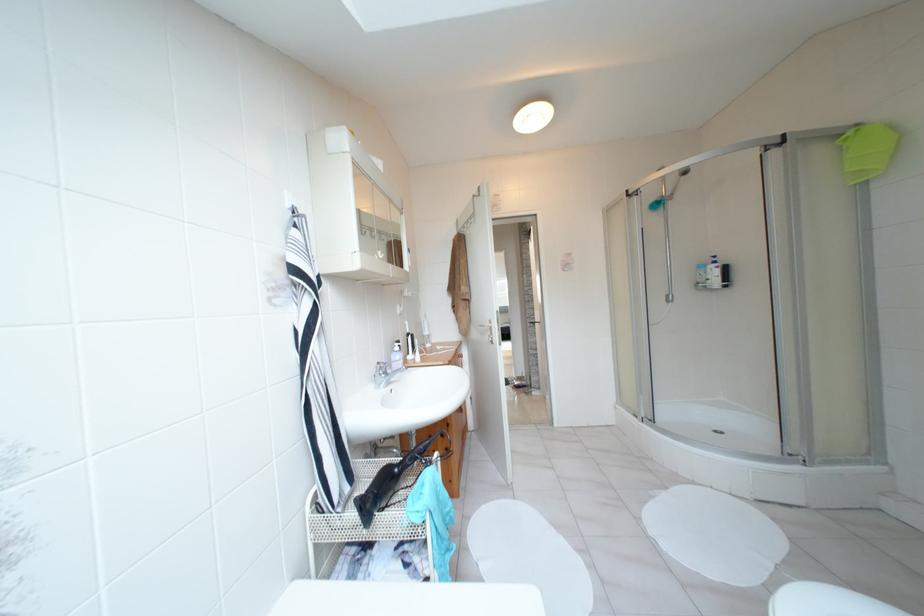
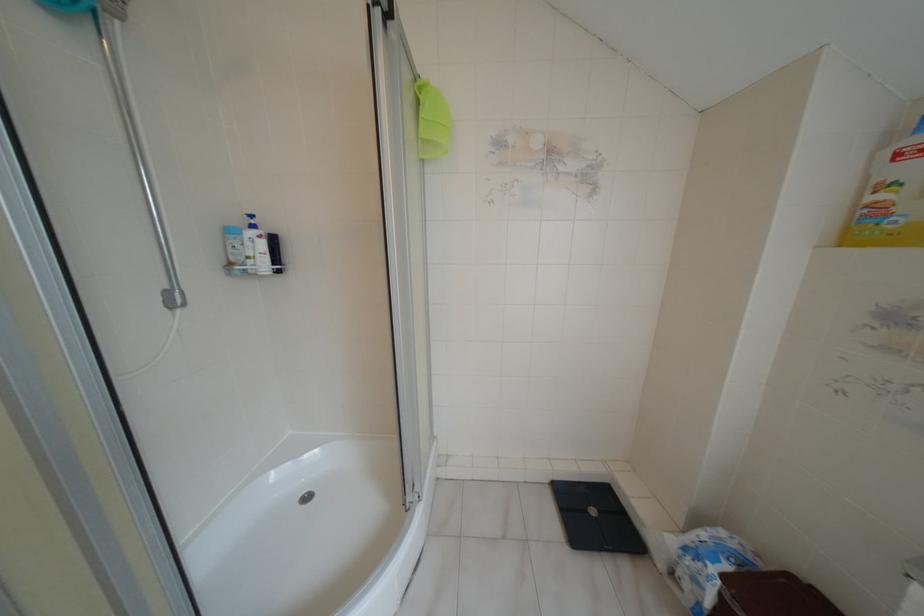
In the second image, find the point that corresponds to point 713,257 in the first image.

(251, 216)